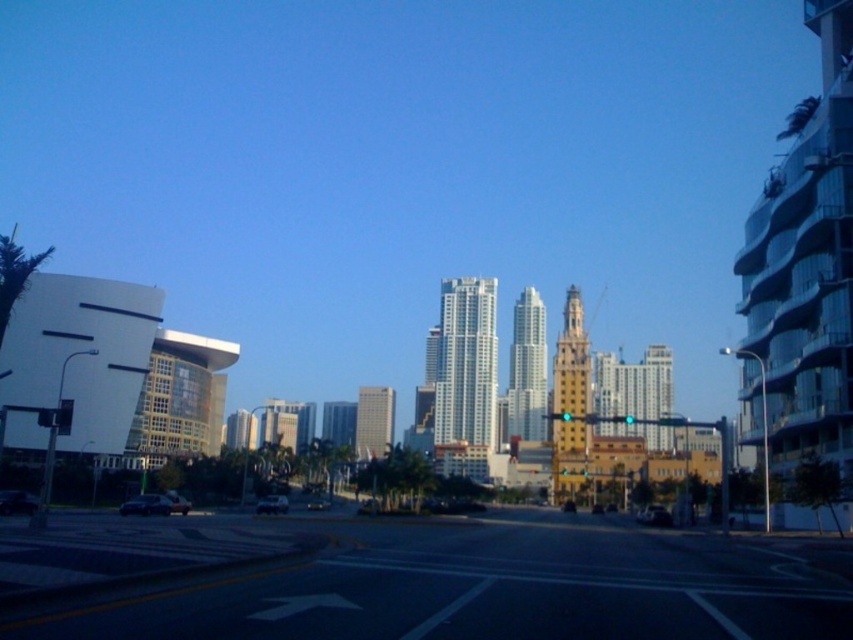
You are standing at the intersection and want to take a photo of the silver glass skyscraper at center. Where should you position yourself to capture it in the frame?

To capture the silver glass skyscraper at center in the frame, position yourself at the intersection facing the direction where the skyscraper is located, which is at coordinates point (527, 369).

You are a delivery driver approaching the intersection and need to turn left. You see the silver glass skyscraper at center and the gray glass skyscraper at center. Which one will you see first as you approach the intersection?

The gray glass skyscraper at center will be seen first because it is positioned to the left of the silver glass skyscraper at center, so as you turn left, the gray one comes into view before the silver one.